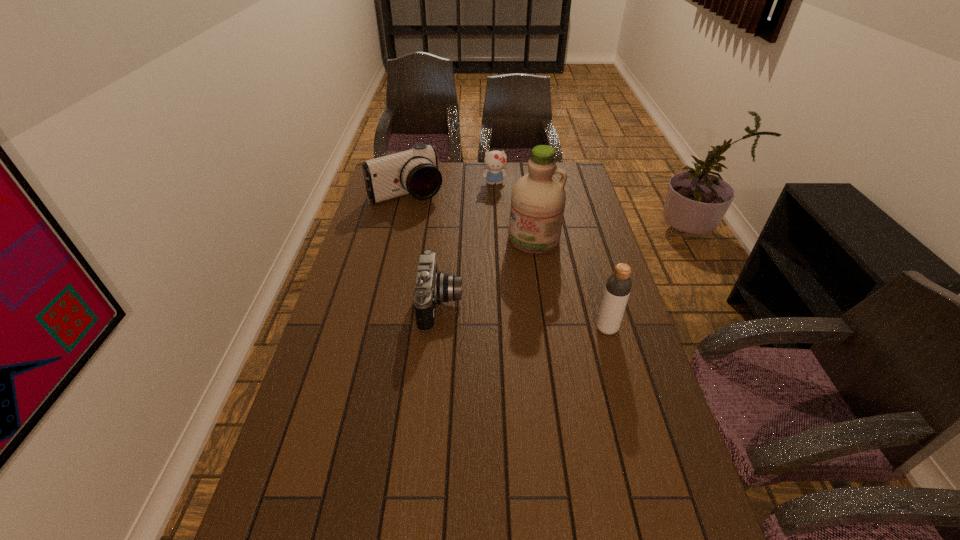
Locate an element on the screen. This screenshot has width=960, height=540. object at the left edge is located at coordinates point(415,171).

This screenshot has height=540, width=960. In order to click on bottle that is at the right edge in this screenshot , I will do `click(618, 285)`.

Find the location of a particular element. cleansing agent that is at the right edge is located at coordinates (538, 198).

Where is `object that is at the far left corner`? object that is at the far left corner is located at coordinates (415, 171).

The height and width of the screenshot is (540, 960). I want to click on free point at the far edge, so click(x=507, y=170).

This screenshot has height=540, width=960. In the image, there is a desktop. Identify the location of vacant space at the left edge. (364, 306).

I want to click on free space at the right edge of the desktop, so click(x=641, y=342).

Image resolution: width=960 pixels, height=540 pixels. In order to click on unoccupied position between the kitten and the bottle in this screenshot , I will do `click(551, 256)`.

This screenshot has height=540, width=960. I want to click on vacant space that is in between the camcorder and the camera, so click(424, 249).

At what (x,y) coordinates should I click in order to perform the action: click on vacant space in between the rightmost object and the camcorder. Please return your answer as a coordinate pair (x, y). Looking at the image, I should click on (507, 261).